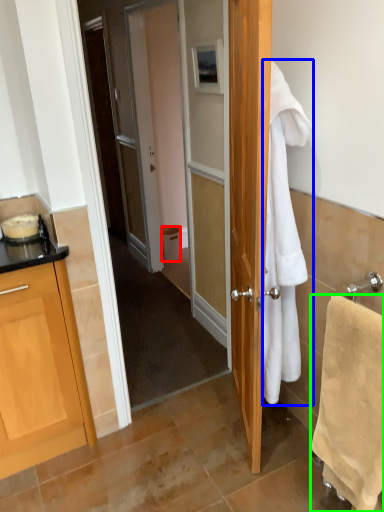
Question: Considering the real-world distances, which object is farthest from trash bin/can (highlighted by a red box)? towel/napkin (highlighted by a blue box) or towel/napkin (highlighted by a green box)?

Choices:
 (A) towel/napkin
 (B) towel/napkin

Answer: (B)